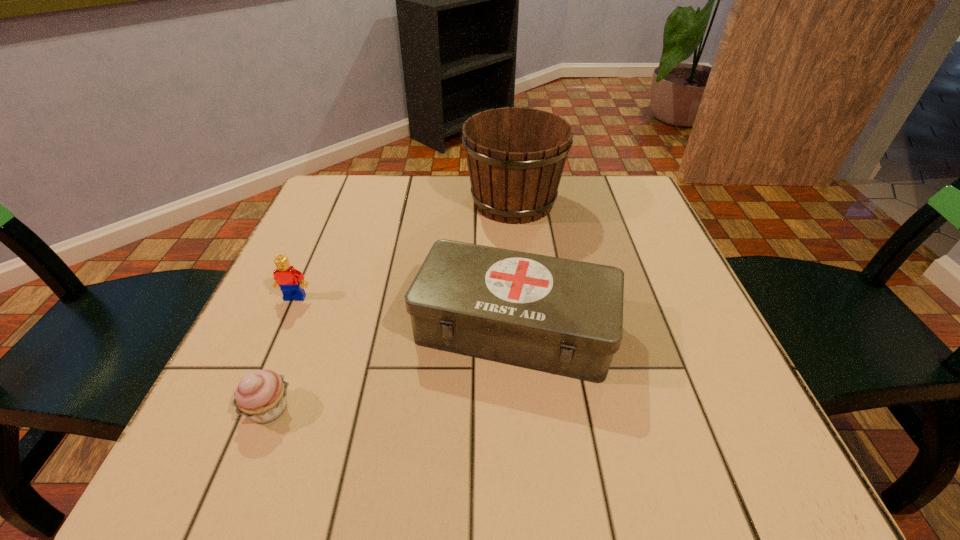
Identify the location of object located at the far edge. (516, 156).

Locate an element on the screen. object at the near edge is located at coordinates (261, 396).

Identify the location of Lego that is at the left edge. (287, 278).

Identify the location of cupcake present at the left edge. (261, 396).

Find the location of a particular element. This screenshot has height=540, width=960. object at the near left corner is located at coordinates (261, 396).

In the image, there is a desktop. Where is `free space at the far edge`? The height and width of the screenshot is (540, 960). free space at the far edge is located at coordinates (443, 200).

You are a GUI agent. You are given a task and a screenshot of the screen. Output one action in this format:
    pyautogui.click(x=<x>, y=<y>)
    Task: Click on the vacant space at the near edge of the desktop
    Image resolution: width=960 pixels, height=540 pixels.
    Given the screenshot: What is the action you would take?
    click(x=583, y=465)

Locate an element on the screen. This screenshot has width=960, height=540. free location at the left edge is located at coordinates (210, 422).

Image resolution: width=960 pixels, height=540 pixels. In the image, there is a desktop. In order to click on vacant space at the right edge in this screenshot , I will do `click(636, 272)`.

Identify the location of vacant point at the far left corner. coord(355,204).